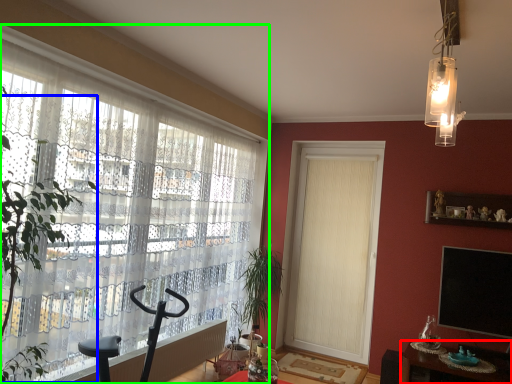
Question: Considering the real-world distances, which object is closest to table (highlighted by a red box)? tree (highlighted by a blue box) or curtain (highlighted by a green box).

Choices:
 (A) tree
 (B) curtain

Answer: (B)